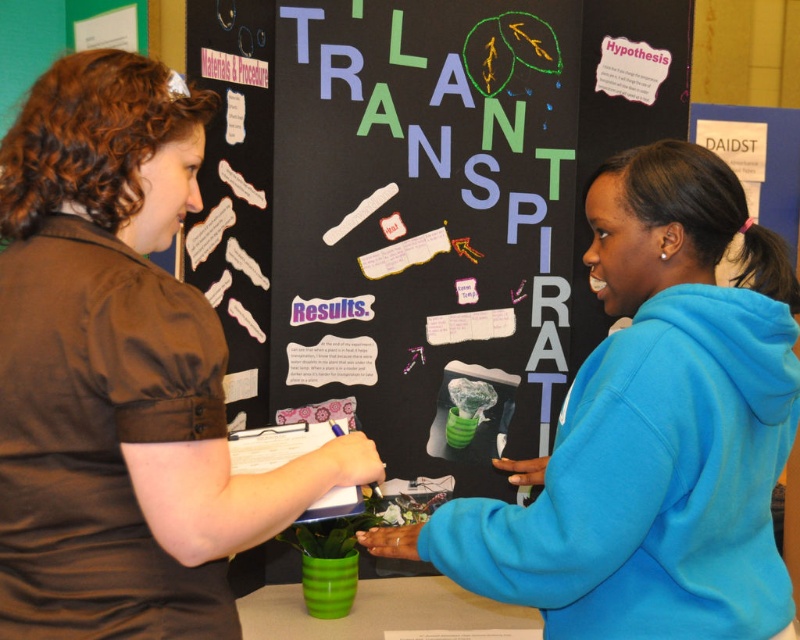
Can you confirm if blackboard at center is positioned to the left of brown fabric shirt at upper left?

No, blackboard at center is not to the left of brown fabric shirt at upper left.

Is blackboard at center wider than brown fabric shirt at upper left?

Indeed, blackboard at center has a greater width compared to brown fabric shirt at upper left.

Which is behind, point (229, 385) or point (150, 476)?

Positioned behind is point (229, 385).

This screenshot has width=800, height=640. Find the location of `blackboard at center`. blackboard at center is located at coordinates (417, 204).

Describe the element at coordinates (120, 372) in the screenshot. I see `brown fabric shirt at upper left` at that location.

Is point (88, 244) farther from camera compared to point (486, 516)?

No, (88, 244) is closer to viewer.

Image resolution: width=800 pixels, height=640 pixels. What are the coordinates of `brown fabric shirt at upper left` in the screenshot? It's located at (120, 372).

Is point (338, 340) behind point (714, 332)?

Yes, it is behind point (714, 332).

Who is taller, blackboard at center or blue fleece sweatshirt at right?

blackboard at center

This screenshot has width=800, height=640. Describe the element at coordinates (417, 204) in the screenshot. I see `blackboard at center` at that location.

In order to click on blackboard at center in this screenshot , I will do `click(417, 204)`.